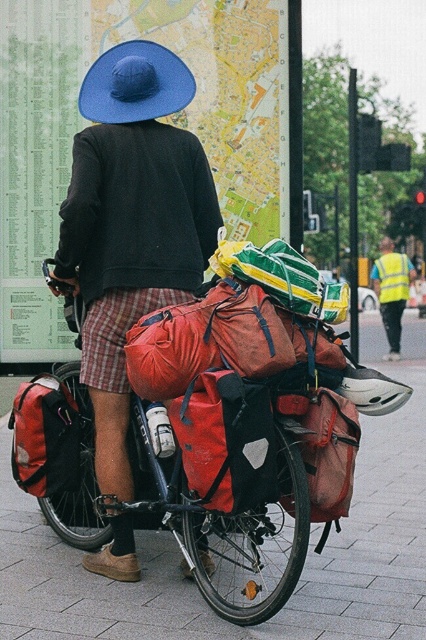
Question: Can you confirm if matte black jacket at center is wider than matte red backpack at center?

Choices:
 (A) no
 (B) yes

Answer: (B)

Question: Which of the following is the closest to the observer?

Choices:
 (A) matte red bag at center
 (B) matte red backpack at lower left
 (C) red fabric bag at center
 (D) matte black jacket at center

Answer: (A)

Question: Does red fabric bag at center lie behind matte red bag at center?

Choices:
 (A) no
 (B) yes

Answer: (B)

Question: Can you confirm if matte black jacket at center is wider than reflective yellow vest at right?

Choices:
 (A) yes
 (B) no

Answer: (A)

Question: Which object is positioned farthest from the blue fabric hat at upper center?

Choices:
 (A) reflective yellow vest at right
 (B) matte black jacket at center

Answer: (A)

Question: Which is nearer to the reflective yellow vest at right?

Choices:
 (A) red fabric bag at center
 (B) blue fabric hat at upper center

Answer: (A)